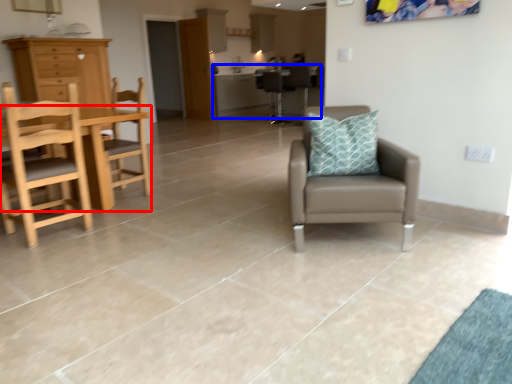
Question: Which point is further to the camera, table (highlighted by a red box) or table (highlighted by a blue box)?

Choices:
 (A) table
 (B) table

Answer: (B)